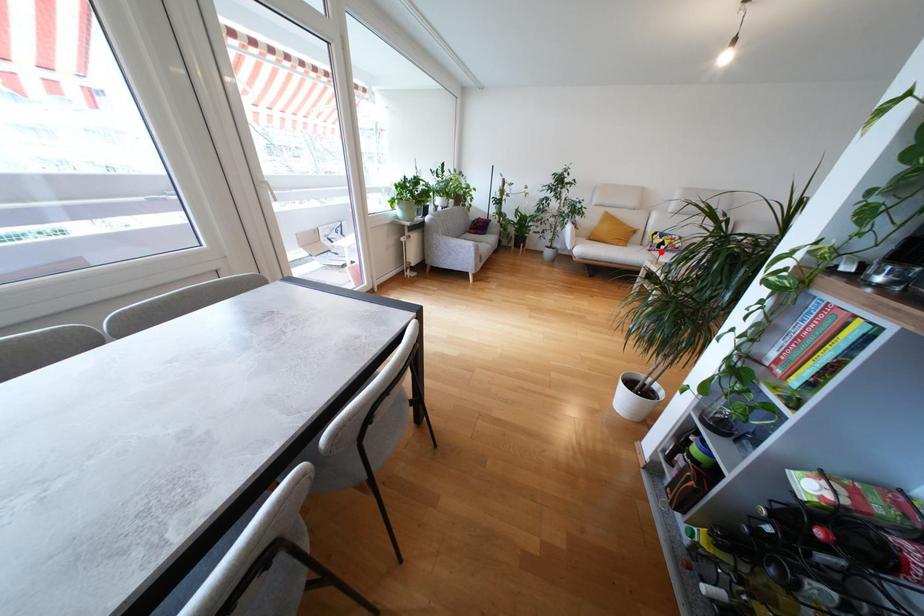
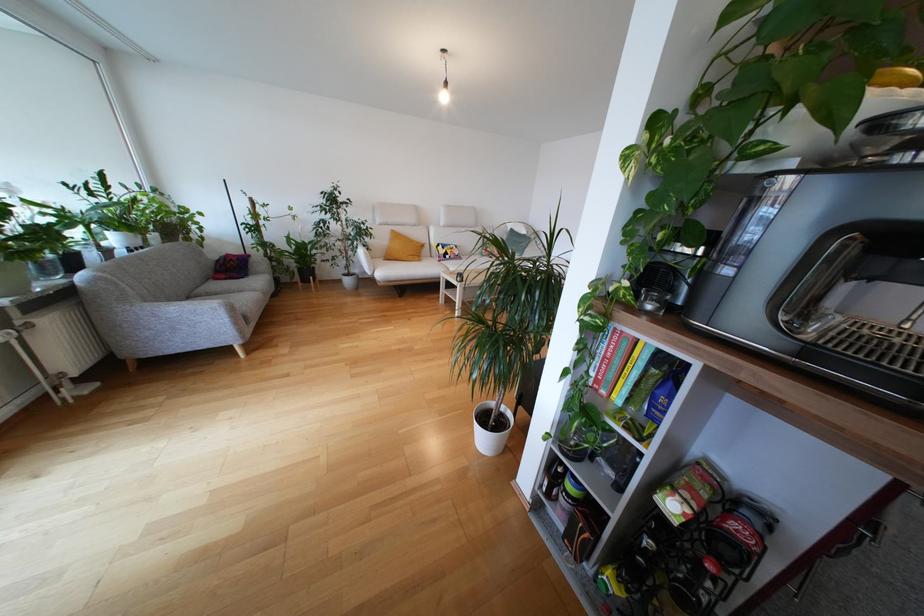
Question: I am providing you with two images of the same scene from different viewpoints. Given a red point in image1, look at the same physical point in image2. Is it:

Choices:
 (A) Closer to the viewpoint
 (B) Farther from the viewpoint

Answer: (B)